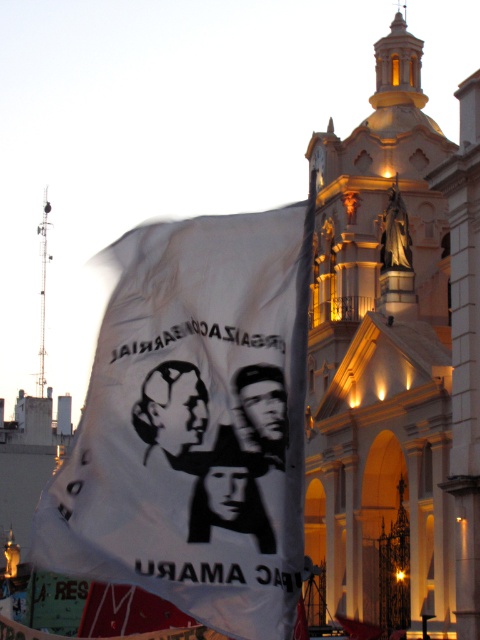
You are standing in front of the grand illuminated building with classical architecture. You want to hold up a sign to take a photo with the flag in the foreground. Where should you position the white paper flag at center to ensure it is centered in the frame?

To center the white paper flag at center in the frame, position it at the coordinates specified by point 0.664 on the x axis and 0.400 on the y axis, as this is the central point of the flag in the image.

You are a photographer standing in front of the grand illuminated building. You notice the white paper flag at center and the black matte face at center in the scene. Which object is positioned higher in the image?

The white paper flag at center is above the black matte face at center, so it is positioned higher in the image.